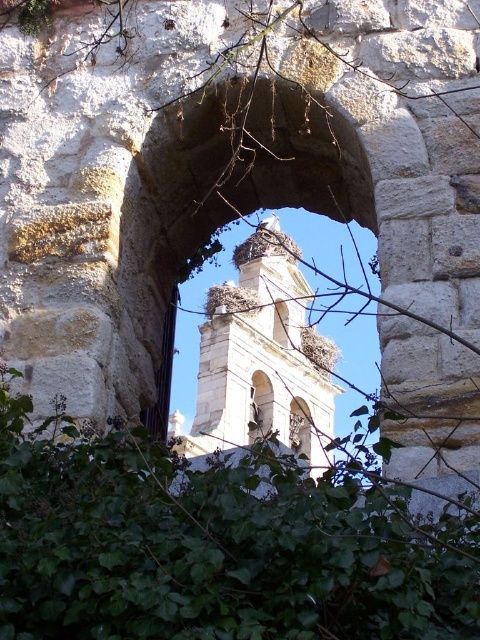
Question: Does white stone bell tower at center appear over brown textured nest at center?

Choices:
 (A) yes
 (B) no

Answer: (B)

Question: Which of the following is the closest to the observer?

Choices:
 (A) (256, 301)
 (B) (224, 394)
 (C) (349, 516)

Answer: (C)

Question: Is white stone bell tower at center positioned before brown textured nest at center?

Choices:
 (A) no
 (B) yes

Answer: (B)

Question: Which object is closer to the camera taking this photo?

Choices:
 (A) green leafy plant at center
 (B) white stone bell tower at center
 (C) brown textured nest at center

Answer: (A)

Question: Is green leafy plant at center positioned in front of brown textured nest at center?

Choices:
 (A) yes
 (B) no

Answer: (A)

Question: Which object appears farthest from the camera in this image?

Choices:
 (A) white stone bell tower at center
 (B) green leafy plant at center
 (C) brown textured nest at center

Answer: (C)